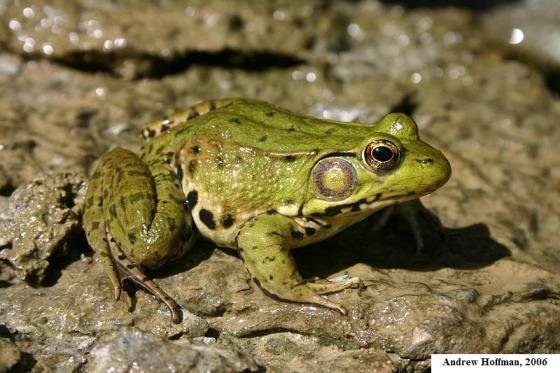
Locate an element on the screen. left front leg is located at coordinates (405, 211).